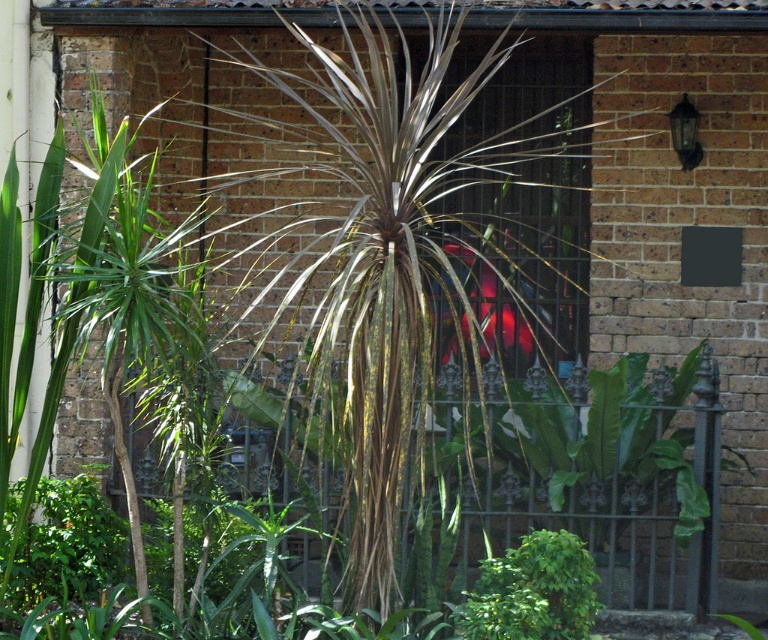
Can you confirm if silvery textured palm tree at center is positioned to the right of green leafy bush at lower center?

No, silvery textured palm tree at center is not to the right of green leafy bush at lower center.

Which is below, silvery textured palm tree at center or green leafy bush at lower center?

Positioned lower is green leafy bush at lower center.

At what (x,y) coordinates should I click in order to perform the action: click on silvery textured palm tree at center. Please return your answer as a coordinate pair (x, y). Image resolution: width=768 pixels, height=640 pixels. Looking at the image, I should click on (396, 257).